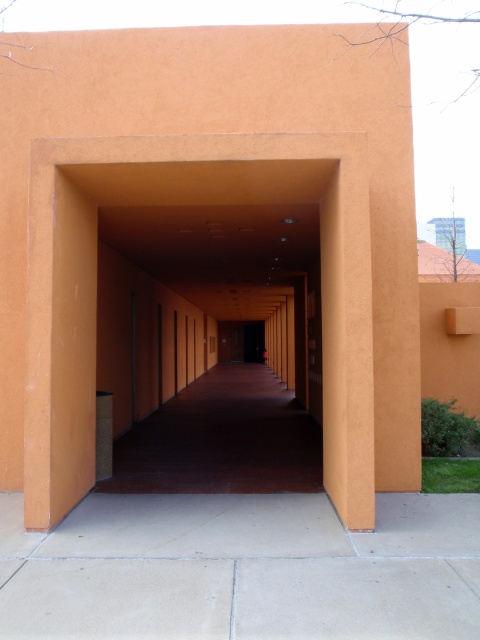
Between smooth concrete pavement at center and orange matte wall at center, which one appears on the left side from the viewer's perspective?

orange matte wall at center

Does smooth concrete pavement at center appear over orange matte wall at center?

Actually, smooth concrete pavement at center is below orange matte wall at center.

Image resolution: width=480 pixels, height=640 pixels. In order to click on smooth concrete pavement at center in this screenshot , I will do `click(241, 570)`.

Between smooth concrete pavement at center and smooth concrete corridor at center, which one appears on the left side from the viewer's perspective?

From the viewer's perspective, smooth concrete corridor at center appears more on the left side.

Is smooth concrete pavement at center above smooth concrete corridor at center?

Yes.

In order to click on smooth concrete pavement at center in this screenshot , I will do `click(241, 570)`.

Between point (58, 380) and point (208, 452), which one is positioned in front?

Point (58, 380) is in front.

Which of these two, orange matte wall at center or smooth concrete corridor at center, stands taller?

orange matte wall at center

Does point (92, 408) lie in front of point (104, 481)?

That is True.

Locate an element on the screen. The height and width of the screenshot is (640, 480). orange matte wall at center is located at coordinates (189, 204).